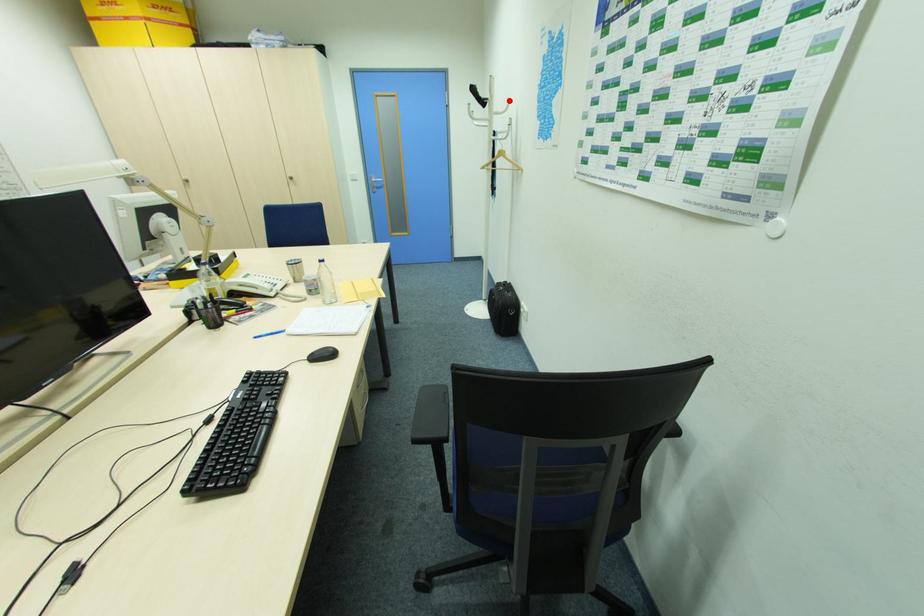
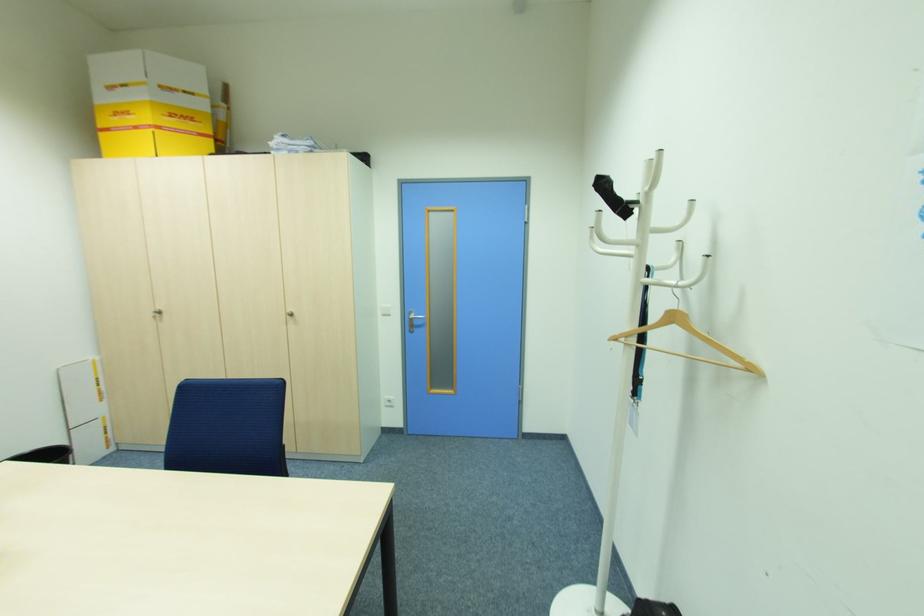
Where in the second image is the point corresponding to the highlighted location from the first image?

(688, 204)